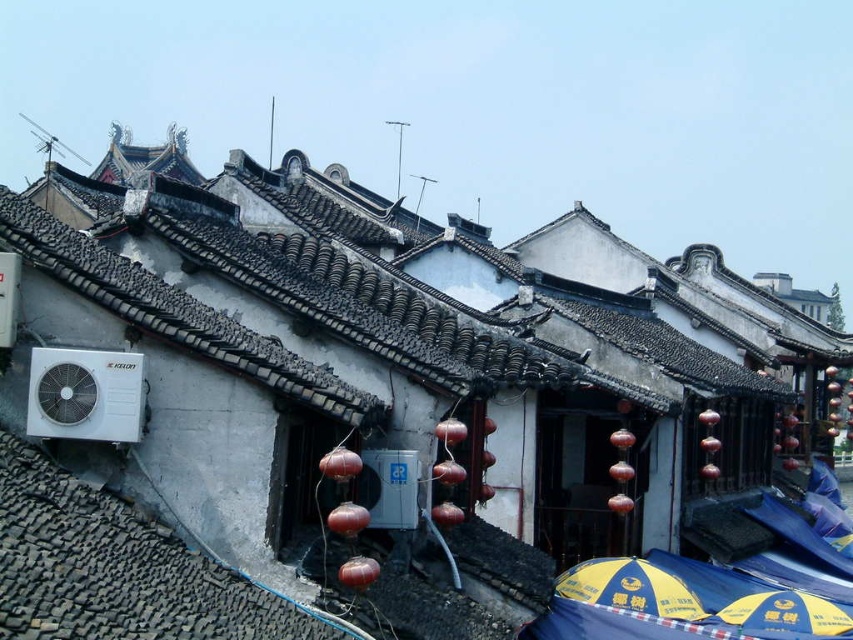
Question: Does dark gray tile roof at center have a greater width compared to yellowmaterial/textureumbrella at lower center?

Choices:
 (A) no
 (B) yes

Answer: (B)

Question: Is dark gray tile roof at center positioned before yellowmaterial/textureumbrella at lower center?

Choices:
 (A) no
 (B) yes

Answer: (B)

Question: Does dark gray tile roof at center have a larger size compared to yellowmaterial/textureumbrella at lower center?

Choices:
 (A) yes
 (B) no

Answer: (A)